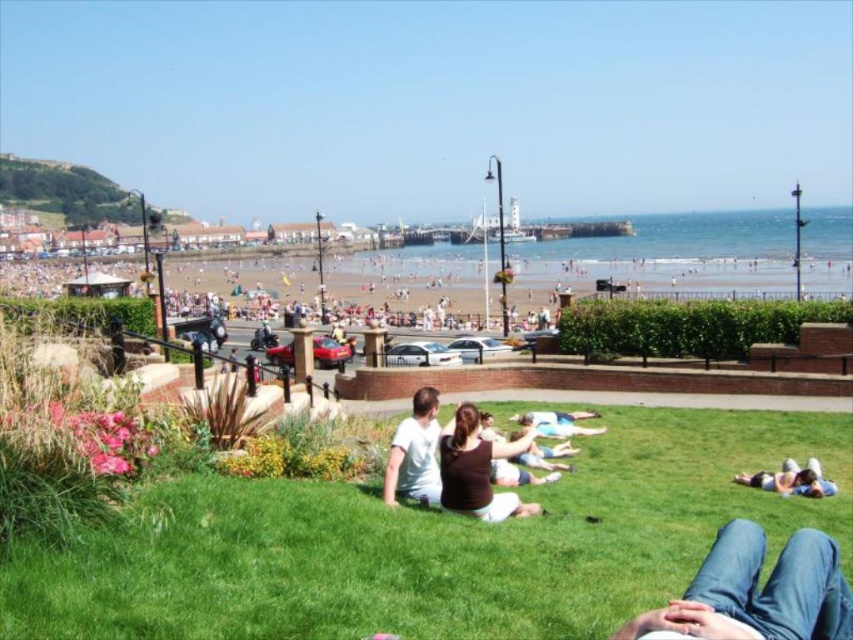
You are standing at the center of the image. Which direction should you move to find the jeans at lower right?

The jeans at lower right are located at coordinates approximately 0.927 on the x axis and 0.887 on the y axis. Since you are at the center, you should move towards the lower right direction to reach them.

You are standing at the center of the grassy area in the seaside scene. You see a point labeled as point (756, 593). What object is located at that point?

The point (756, 593) corresponds to jeans at lower right.